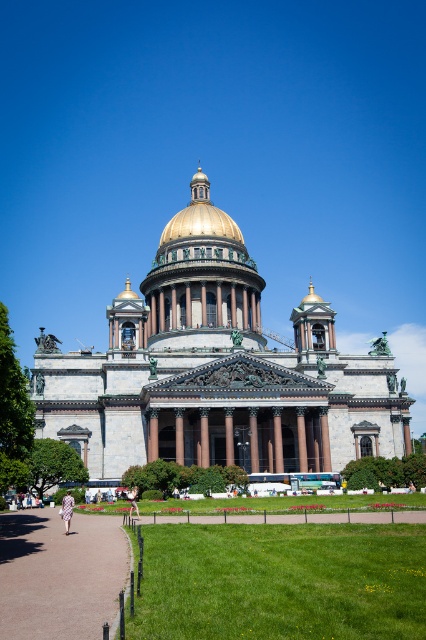
Between point (126, 397) and point (135, 486), which one is positioned in front?

Positioned in front is point (135, 486).

Who is higher up, golden dome church at center or light brown leather jacket at center?

golden dome church at center

Find the location of a particular element. golden dome church at center is located at coordinates (215, 371).

This screenshot has height=640, width=426. What do you see at coordinates (60, 573) in the screenshot?
I see `brown gravel path at lower left` at bounding box center [60, 573].

Is point (32, 579) positioned behind point (186, 220)?

No, it is in front of (186, 220).

This screenshot has width=426, height=640. I want to click on brown gravel path at lower left, so click(60, 573).

Consider the image. Between plaid fabric dress at center and light brown leather jacket at center, which one appears on the right side from the viewer's perspective?

→ light brown leather jacket at center is more to the right.

Is point (68, 520) positioned before point (135, 488)?

Yes, it is.

At what (x,y) coordinates should I click in order to perform the action: click on plaid fabric dress at center. Please return your answer as a coordinate pair (x, y). The width and height of the screenshot is (426, 640). Looking at the image, I should click on (66, 509).